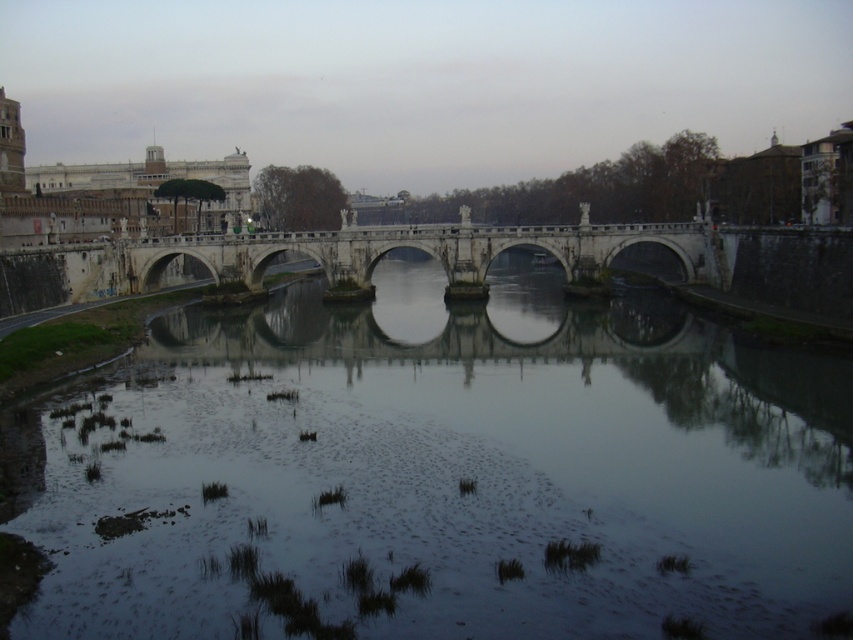
Question: Is dark reflective water at center wider than stone bridge at center?

Choices:
 (A) yes
 (B) no

Answer: (B)

Question: Which point is closer to the camera?

Choices:
 (A) stone bridge at center
 (B) dark reflective water at center

Answer: (B)

Question: Which point is farther to the camera?

Choices:
 (A) (688, 227)
 (B) (590, 579)

Answer: (A)

Question: Does dark reflective water at center appear over stone bridge at center?

Choices:
 (A) no
 (B) yes

Answer: (A)

Question: Is dark reflective water at center wider than stone bridge at center?

Choices:
 (A) no
 (B) yes

Answer: (A)